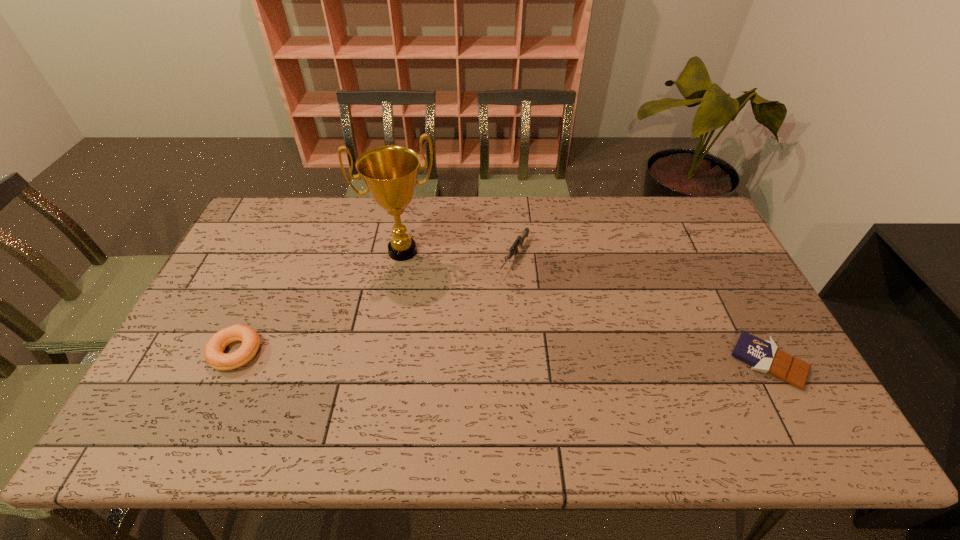
Select which object is the second closest to the bagel. Please provide its 2D coordinates. Your answer should be formatted as a tuple, i.e. [(x, y)], where the tuple contains the x and y coordinates of a point satisfying the conditions above.

[(519, 241)]